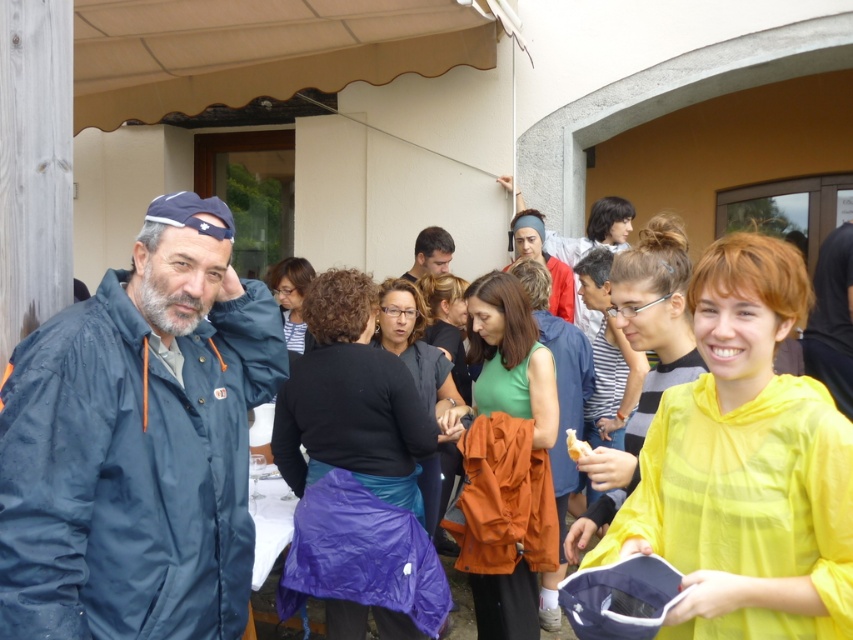
Describe the element at coordinates (138, 442) in the screenshot. I see `matte blue jacket at left` at that location.

Between matte blue jacket at left and matte blue jacket at center, which one appears on the right side from the viewer's perspective?

matte blue jacket at center is more to the right.

This screenshot has height=640, width=853. What are the coordinates of `matte blue jacket at left` in the screenshot? It's located at (138, 442).

Between matte blue jacket at center and matte black hair at center, which one appears on the left side from the viewer's perspective?

From the viewer's perspective, matte black hair at center appears more on the left side.

Between point (524, 225) and point (434, 273), which one is positioned in front?

Point (524, 225)

Find the location of a particular element. matte blue jacket at center is located at coordinates (543, 260).

Locate an element on the screen. Image resolution: width=853 pixels, height=640 pixels. matte blue jacket at left is located at coordinates (138, 442).

Between point (248, 570) and point (439, 253), which one is positioned in front?

Point (248, 570) is in front.

Where is `matte blue jacket at left`? This screenshot has width=853, height=640. matte blue jacket at left is located at coordinates 138,442.